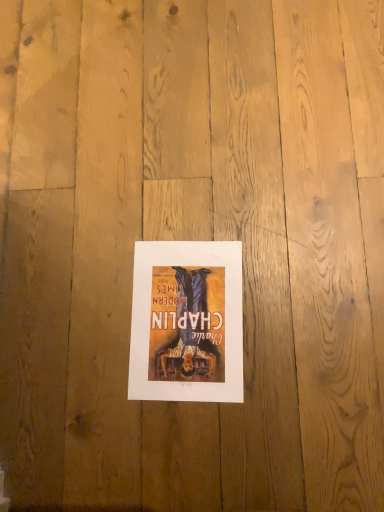
At what (x,y) coordinates should I click in order to perform the action: click on blank space above matte paper poster at center (from a real-world perspective). Please return your answer as a coordinate pair (x, y). The width and height of the screenshot is (384, 512). Looking at the image, I should click on (185, 310).